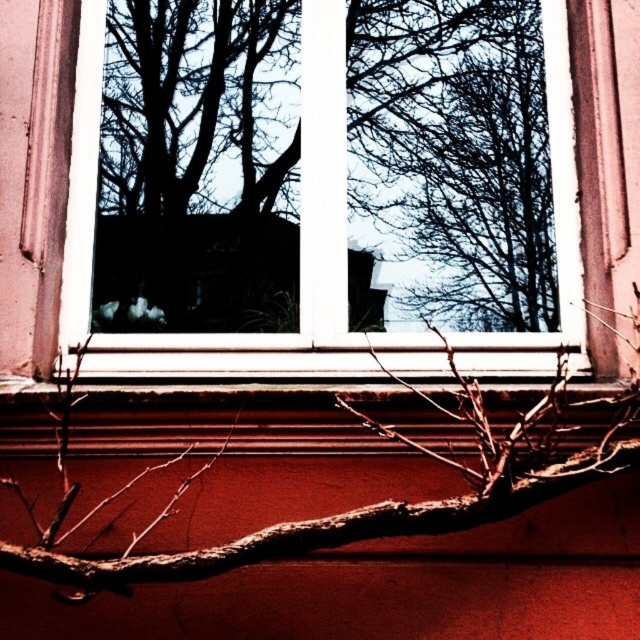
Question: Which of these objects is positioned farthest from the black silhouette tree at center?

Choices:
 (A) white plastic window frame at center
 (B) brown rough branch at lower center
 (C) silhouette bare branches at upper center

Answer: (B)

Question: Does white plastic window frame at center appear on the right side of silhouette bare branches at upper center?

Choices:
 (A) no
 (B) yes

Answer: (A)

Question: Which of the following is the closest to the observer?

Choices:
 (A) brown rough branch at lower center
 (B) silhouette bare branches at upper center
 (C) black silhouette tree at center
 (D) white plastic window frame at center

Answer: (A)

Question: Does black silhouette tree at center lie in front of brown rough branch at lower center?

Choices:
 (A) no
 (B) yes

Answer: (A)

Question: Which point appears farthest from the camera in this image?

Choices:
 (A) (499, 186)
 (B) (252, 116)

Answer: (B)

Question: Can you confirm if white plastic window frame at center is thinner than brown rough branch at lower center?

Choices:
 (A) yes
 (B) no

Answer: (B)